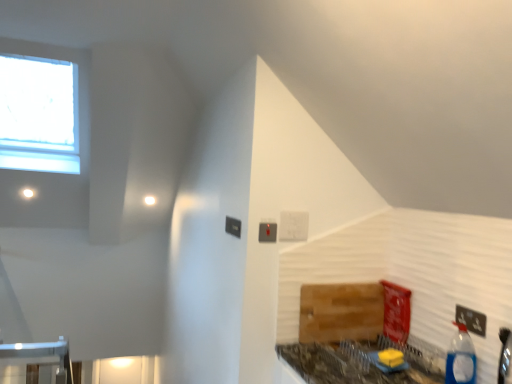
In order to click on blue plastic bottle at lower right in this screenshot , I will do `click(461, 358)`.

The image size is (512, 384). What are the coordinates of `black plastic electric outlet at lower right` in the screenshot? It's located at (471, 320).

Where is `marble-patterned countertop at lower right`? This screenshot has width=512, height=384. marble-patterned countertop at lower right is located at coordinates (358, 363).

Does black plastic electric outlet at lower right have a greater width compared to marble-patterned countertop at lower right?

Incorrect, the width of black plastic electric outlet at lower right does not surpass that of marble-patterned countertop at lower right.

Which point is more distant from viewer, (486, 319) or (331, 371)?

Point (331, 371)

Which object is positioned more to the right, black plastic electric outlet at lower right or marble-patterned countertop at lower right?

black plastic electric outlet at lower right is more to the right.

Is black plastic electric outlet at lower right not close to marble-patterned countertop at lower right?

No.

Considering the positions of point (446, 360) and point (320, 286), is point (446, 360) closer or farther from the camera than point (320, 286)?

Point (446, 360).

Consider the image. Does blue plastic bottle at lower right touch wooden cutting board at lower right?

No.

Which object is further away from the camera taking this photo, blue plastic bottle at lower right or wooden cutting board at lower right?

wooden cutting board at lower right.

From the image's perspective, which object appears higher, blue plastic bottle at lower right or wooden cutting board at lower right?

wooden cutting board at lower right appears higher in the image.

Considering the positions of objects wooden cutting board at lower right and black plastic electric outlet at lower right in the image provided, who is behind, wooden cutting board at lower right or black plastic electric outlet at lower right?

Positioned behind is wooden cutting board at lower right.

Is the surface of wooden cutting board at lower right in direct contact with black plastic electric outlet at lower right?

No, wooden cutting board at lower right is not beside black plastic electric outlet at lower right.

From the image's perspective, which one is positioned lower, wooden cutting board at lower right or black plastic electric outlet at lower right?

wooden cutting board at lower right.

Which object is thinner, wooden cutting board at lower right or black plastic electric outlet at lower right?

Thinner between the two is black plastic electric outlet at lower right.

How different are the orientations of wooden cutting board at lower right and blue plastic bottle at lower right in degrees?

They differ by 90.3 degrees in their facing directions.

From a real-world perspective, is wooden cutting board at lower right positioned above or below blue plastic bottle at lower right?

wooden cutting board at lower right is above blue plastic bottle at lower right.

Considering the sizes of objects wooden cutting board at lower right and blue plastic bottle at lower right in the image provided, who is taller, wooden cutting board at lower right or blue plastic bottle at lower right?

With more height is wooden cutting board at lower right.

Is wooden cutting board at lower right facing towards blue plastic bottle at lower right?

Yes, wooden cutting board at lower right faces towards blue plastic bottle at lower right.

Is blue plastic bottle at lower right directly adjacent to black plastic electric outlet at lower right?

Yes, blue plastic bottle at lower right is in contact with black plastic electric outlet at lower right.

Based on the photo, which object is closer to the camera taking this photo, blue plastic bottle at lower right or black plastic electric outlet at lower right?

blue plastic bottle at lower right is more forward.

Between blue plastic bottle at lower right and black plastic electric outlet at lower right, which one has larger size?

With larger size is blue plastic bottle at lower right.

Where is `electric outlet above the blue plastic bottle at lower right (from the image's perspective)`? electric outlet above the blue plastic bottle at lower right (from the image's perspective) is located at coordinates (471, 320).

Can you see black plastic electric outlet at lower right touching wooden cutting board at lower right?

black plastic electric outlet at lower right and wooden cutting board at lower right are not in contact.

Which point is more distant from viewer, (468, 328) or (306, 295)?

The point (306, 295) is farther from the camera.

Is black plastic electric outlet at lower right completely or partially outside of wooden cutting board at lower right?

Absolutely, black plastic electric outlet at lower right is external to wooden cutting board at lower right.

From the picture: Could you tell me if black plastic electric outlet at lower right is turned towards wooden cutting board at lower right?

No.

From the image's perspective, is marble-patterned countertop at lower right located beneath wooden cutting board at lower right?

Correct, marble-patterned countertop at lower right appears lower than wooden cutting board at lower right in the image.

From the picture: Is the surface of marble-patterned countertop at lower right in direct contact with wooden cutting board at lower right?

No, marble-patterned countertop at lower right is not making contact with wooden cutting board at lower right.

In the scene shown: Looking at their sizes, would you say marble-patterned countertop at lower right is wider or thinner than wooden cutting board at lower right?

Considering their sizes, marble-patterned countertop at lower right looks broader than wooden cutting board at lower right.

How different are the orientations of marble-patterned countertop at lower right and wooden cutting board at lower right in degrees?

They differ by 90 degrees in their facing directions.

This screenshot has height=384, width=512. Find the location of `electric outlet behind the marble-patterned countertop at lower right`. electric outlet behind the marble-patterned countertop at lower right is located at coordinates (471, 320).

Image resolution: width=512 pixels, height=384 pixels. In order to click on cabinetry positioned vertically above the blue plastic bottle at lower right (from a real-world perspective) in this screenshot , I will do `click(341, 312)`.

Looking at this image, based on their spatial positions, is wooden cutting board at lower right or blue plastic bottle at lower right closer to marble-patterned countertop at lower right?

Based on the image, wooden cutting board at lower right appears to be nearer to marble-patterned countertop at lower right.

Looking at the image, which one is located further to blue plastic bottle at lower right, wooden cutting board at lower right or black plastic electric outlet at lower right?

wooden cutting board at lower right.

Looking at this image, based on their spatial positions, is black plastic electric outlet at lower right or blue plastic bottle at lower right further from wooden cutting board at lower right?

black plastic electric outlet at lower right.

When comparing their distances from blue plastic bottle at lower right, does marble-patterned countertop at lower right or black plastic electric outlet at lower right seem further?

The object further to blue plastic bottle at lower right is marble-patterned countertop at lower right.

Looking at the image, which one is located further to marble-patterned countertop at lower right, wooden cutting board at lower right or black plastic electric outlet at lower right?

black plastic electric outlet at lower right is positioned further to the anchor marble-patterned countertop at lower right.

From the image, which object appears to be farther from wooden cutting board at lower right, blue plastic bottle at lower right or marble-patterned countertop at lower right?

Based on the image, blue plastic bottle at lower right appears to be further to wooden cutting board at lower right.

When comparing their distances from marble-patterned countertop at lower right, does black plastic electric outlet at lower right or wooden cutting board at lower right seem further?

black plastic electric outlet at lower right lies further to marble-patterned countertop at lower right than the other object.

Considering their positions, is marble-patterned countertop at lower right positioned further to blue plastic bottle at lower right than wooden cutting board at lower right?

wooden cutting board at lower right.

The width and height of the screenshot is (512, 384). In order to click on electric outlet between blue plastic bottle at lower right and wooden cutting board at lower right in the front-back direction in this screenshot , I will do `click(471, 320)`.

Where is `bottle between marble-patterned countertop at lower right and black plastic electric outlet at lower right from left to right`? bottle between marble-patterned countertop at lower right and black plastic electric outlet at lower right from left to right is located at coordinates (461, 358).

This screenshot has width=512, height=384. Identify the location of electric outlet between marble-patterned countertop at lower right and wooden cutting board at lower right from front to back. (471, 320).

Locate an element on the screen. bottle between marble-patterned countertop at lower right and wooden cutting board at lower right in the front-back direction is located at coordinates (461, 358).